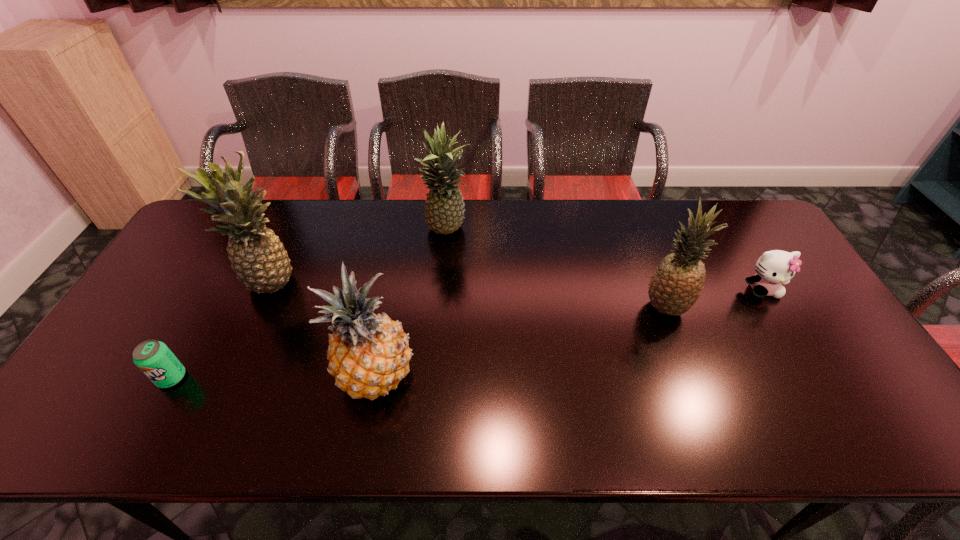
Locate an element on the screen. This screenshot has width=960, height=540. free space between the nearest pineapple and the farthest pineapple is located at coordinates click(412, 303).

Point out which object is positioned as the second nearest to the leftmost pineapple. Please provide its 2D coordinates. Your answer should be formatted as a tuple, i.e. [(x, y)], where the tuple contains the x and y coordinates of a point satisfying the conditions above.

[(369, 355)]

The width and height of the screenshot is (960, 540). Identify the location of object that is the closest to the pop soda. (261, 263).

Where is `pineapple object that ranks as the third closest to the shortest object`? The image size is (960, 540). pineapple object that ranks as the third closest to the shortest object is located at coordinates click(x=444, y=212).

The image size is (960, 540). In order to click on the second closest pineapple to the farthest object in this screenshot , I will do `click(369, 355)`.

I want to click on vacant region that satisfies the following two spatial constraints: 1. on the back side of the fifth object from left to right; 2. on the right side of the nearest pineapple, so click(389, 307).

At what (x,y) coordinates should I click in order to perform the action: click on vacant space that satisfies the following two spatial constraints: 1. on the back side of the nearest pineapple; 2. on the left side of the farthest object. Please return your answer as a coordinate pair (x, y). The image size is (960, 540). Looking at the image, I should click on (403, 231).